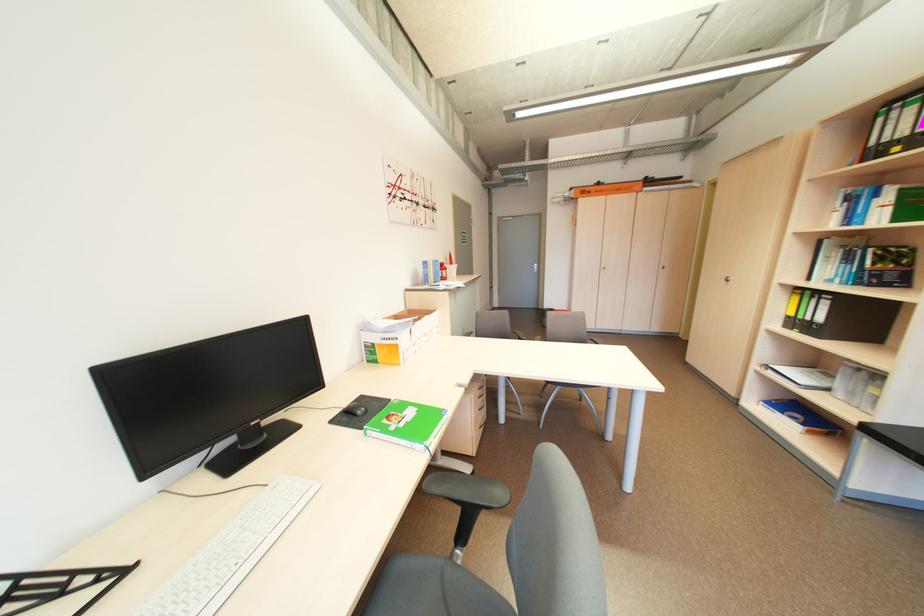
The height and width of the screenshot is (616, 924). What do you see at coordinates (467, 495) in the screenshot?
I see `a black chair armrest` at bounding box center [467, 495].